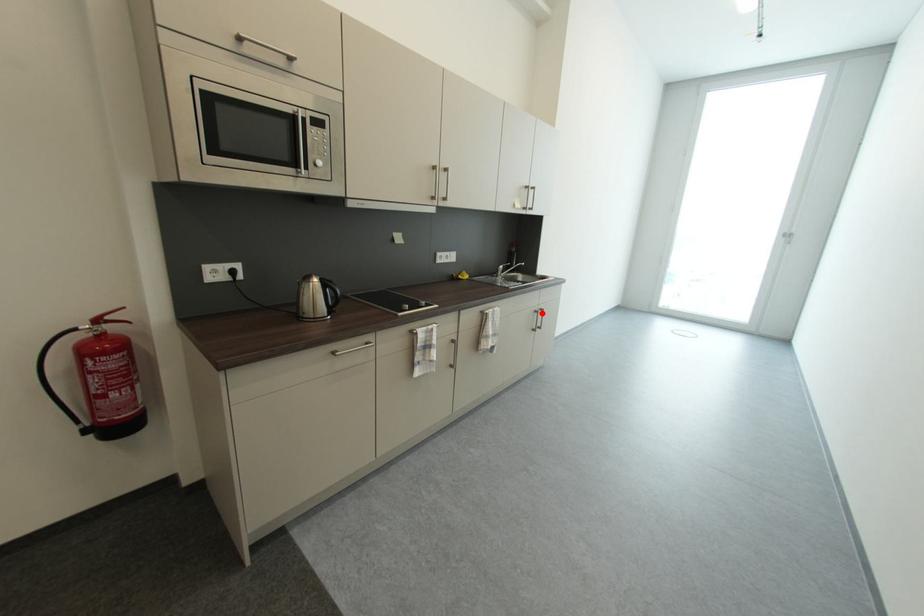
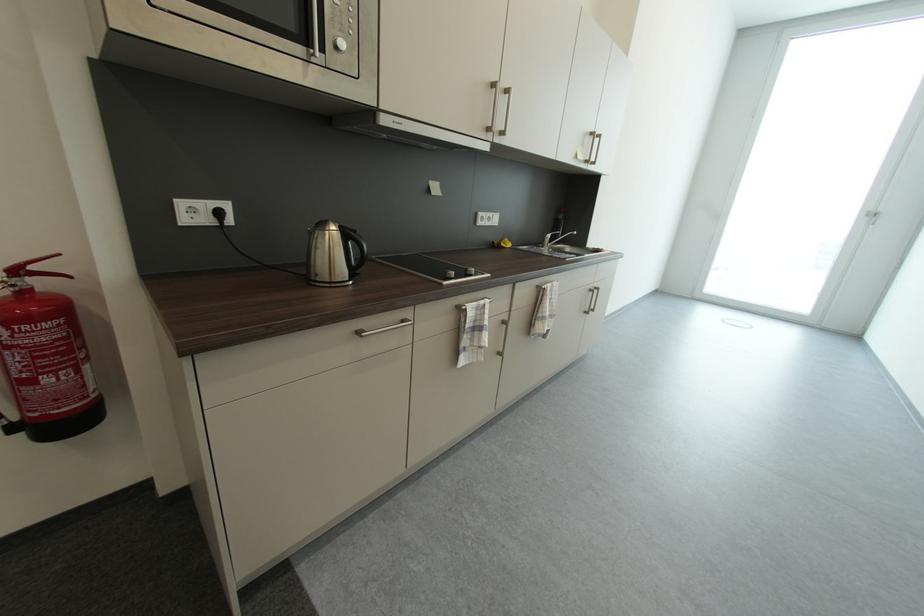
Question: I am providing you with two images of the same scene from different viewpoints. Image1 has a red point marked. In image2, the corresponding 3D location appears at what relative position? Reply with the corresponding letter.

Choices:
 (A) Closer
 (B) Farther

Answer: (B)